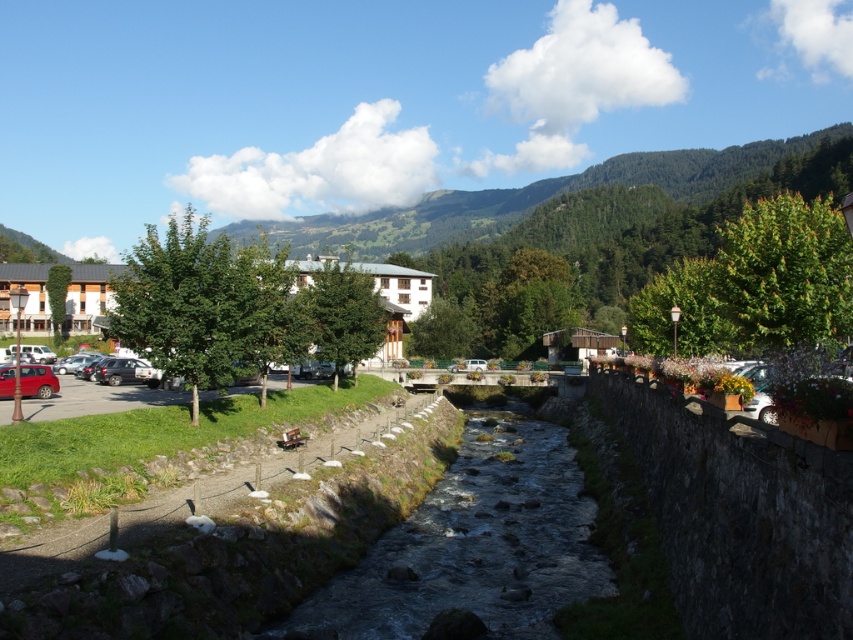
You are standing at the edge of the stream in the small town scene. You want to cross to the other side. The clear water at center is flowing swiftly. Is there a safe spot to cross where the water is shallower and slower?

The clear water at center is flowing swiftly, so it might not be the best spot to cross. Look for areas where the water is shallower and slower, possibly near the edges or around the rocks and pebbles mentioned in the scene description.

You are a painter standing at the edge of the stream near the stone wall. You want to paint the clear water at center and the matte red car at lower left. Which object should you paint first if you want to start with the one that appears taller in the scene?

The clear water at center is much taller than the matte red car at lower left, so you should paint the clear water at center first.